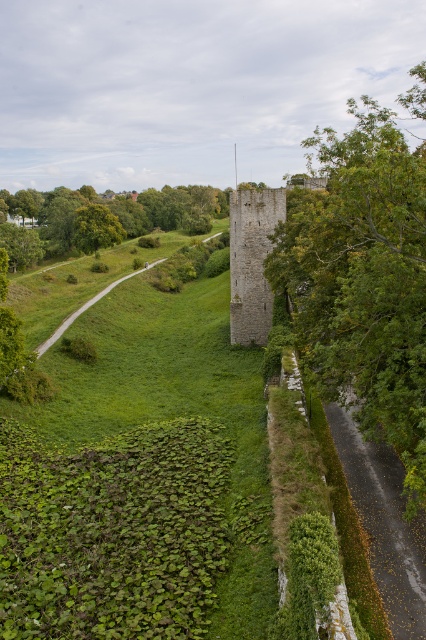
You are standing on the path leading to the historic stone tower. You notice the green leafy grass at center and the green leafy tree at right. Which one is closer to you?

The green leafy grass at center is closer to you since it is further to the viewer than the green leafy tree at right.

You are standing at the base of the historic stone tower and want to walk towards the green leafy tree at lower left. Which direction should you walk to avoid passing by the green leafy tree at right?

You should walk towards the green leafy tree at lower left without passing the green leafy tree at right, since the green leafy tree at right is closer to the viewer than the green leafy tree at lower left, meaning the tree at right is in front. To avoid it, walk around to the side opposite of the green leafy tree at right.